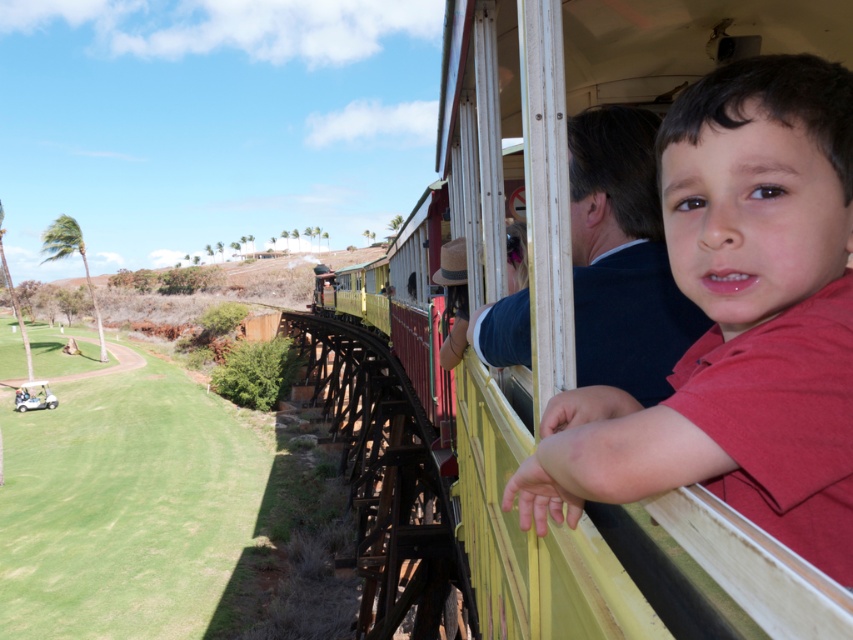
Question: Does matte red shirt at center have a smaller size compared to green grass at lower left?

Choices:
 (A) no
 (B) yes

Answer: (B)

Question: Which of the following is the farthest from the observer?

Choices:
 (A) (749, 195)
 (B) (15, 589)

Answer: (B)

Question: Which of the following is the farthest from the observer?

Choices:
 (A) green grass at lower left
 (B) matte red shirt at center

Answer: (A)

Question: Is matte red shirt at center wider than green grass at lower left?

Choices:
 (A) no
 (B) yes

Answer: (A)

Question: Which object appears farthest from the camera in this image?

Choices:
 (A) green grass at lower left
 (B) matte red shirt at center

Answer: (A)

Question: Is matte red shirt at center bigger than green grass at lower left?

Choices:
 (A) yes
 (B) no

Answer: (B)